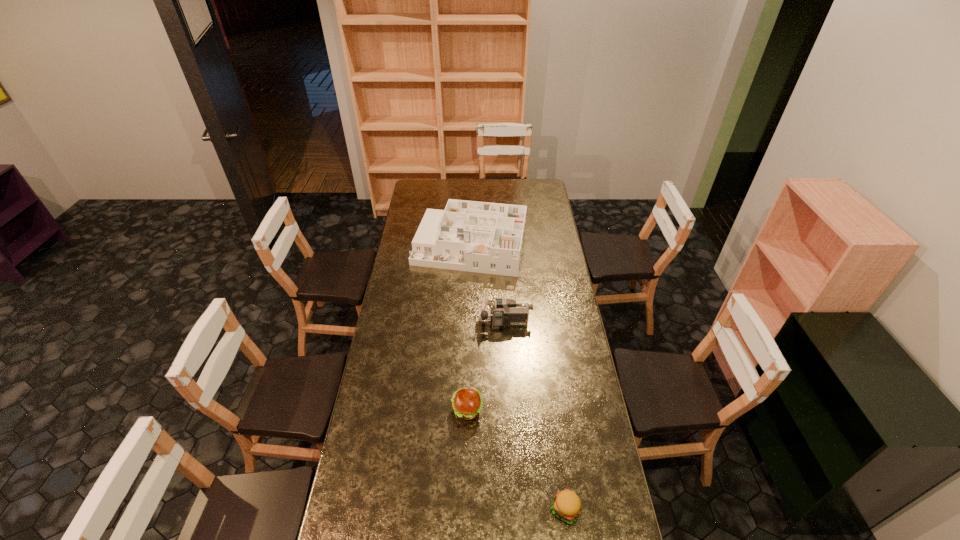
Where is `vacant area in the image that satisfies the following two spatial constraints: 1. on the back side of the right hamburger; 2. on the front-facing side of the camcorder`? Image resolution: width=960 pixels, height=540 pixels. vacant area in the image that satisfies the following two spatial constraints: 1. on the back side of the right hamburger; 2. on the front-facing side of the camcorder is located at coordinates (540, 322).

You are a GUI agent. You are given a task and a screenshot of the screen. Output one action in this format:
    pyautogui.click(x=<x>, y=<y>)
    Task: Click on the free location that satisfies the following two spatial constraints: 1. on the front-facing side of the second farthest object; 2. on the back side of the shortest object
    The width and height of the screenshot is (960, 540).
    Given the screenshot: What is the action you would take?
    (x=516, y=509)

Find the location of a particular element. This screenshot has height=540, width=960. vacant space that satisfies the following two spatial constraints: 1. on the front-facing side of the right hamburger; 2. on the right side of the second farthest object is located at coordinates (516, 509).

Identify the location of vacant space that satisfies the following two spatial constraints: 1. on the front-facing side of the right hamburger; 2. on the right side of the second farthest object. The height and width of the screenshot is (540, 960). (516, 509).

Identify the location of free region that satisfies the following two spatial constraints: 1. on the front-facing side of the camcorder; 2. on the back side of the nearest object. (516, 509).

Find the location of `vacant region that satisfies the following two spatial constraints: 1. on the front side of the farther hamburger; 2. on the left side of the shorter hamburger`. vacant region that satisfies the following two spatial constraints: 1. on the front side of the farther hamburger; 2. on the left side of the shorter hamburger is located at coordinates (465, 509).

Where is `vacant space that satisfies the following two spatial constraints: 1. on the front-facing side of the camcorder; 2. on the back side of the nearer hamburger`? vacant space that satisfies the following two spatial constraints: 1. on the front-facing side of the camcorder; 2. on the back side of the nearer hamburger is located at coordinates (516, 509).

Locate an element on the screen. The height and width of the screenshot is (540, 960). free location that satisfies the following two spatial constraints: 1. on the front side of the farthest object; 2. on the right side of the second nearest object is located at coordinates (466, 410).